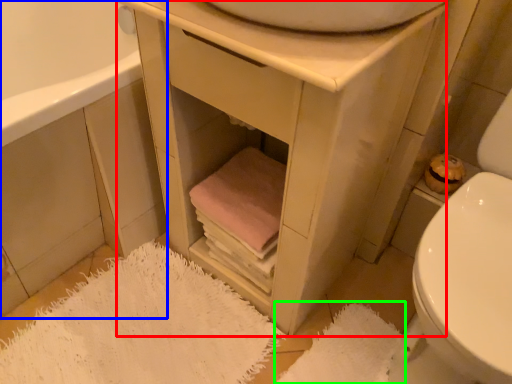
Question: Which is nearer to the vanity (highlighted by a red box)? cabinetry (highlighted by a blue box) or bath mat (highlighted by a green box).

Choices:
 (A) cabinetry
 (B) bath mat

Answer: (A)